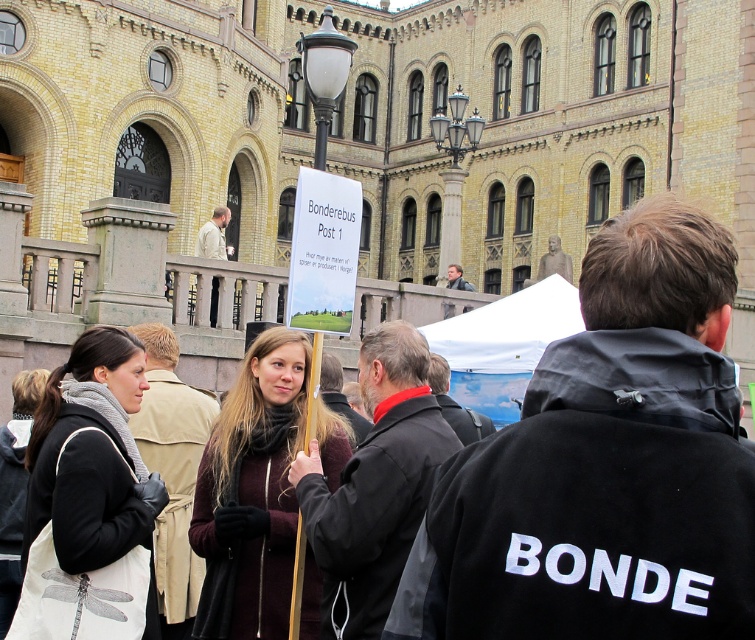
Question: Does black fabric bag at lower left appear under maroon woolen sweater at center?

Choices:
 (A) yes
 (B) no

Answer: (B)

Question: Does black fabric bag at lower left have a lesser width compared to maroon woolen sweater at center?

Choices:
 (A) no
 (B) yes

Answer: (B)

Question: Which of the following is the closest to the observer?

Choices:
 (A) (29, 499)
 (B) (205, 483)

Answer: (A)

Question: Can you confirm if black fabric bag at lower left is thinner than maroon woolen sweater at center?

Choices:
 (A) no
 (B) yes

Answer: (B)